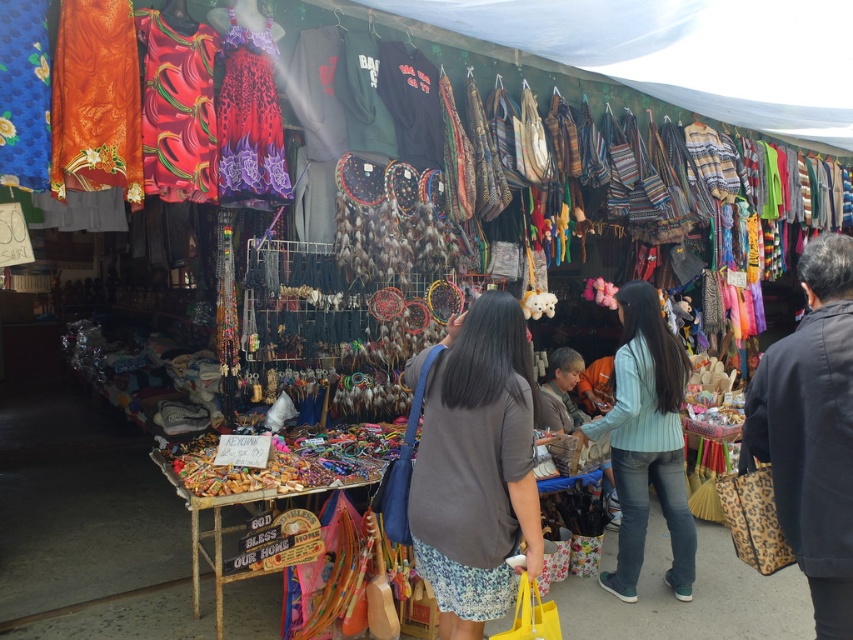
Can you confirm if dark gray shirt at center is positioned to the right of light blue striped shirt at center?

Incorrect, dark gray shirt at center is not on the right side of light blue striped shirt at center.

Where is `dark gray shirt at center`? dark gray shirt at center is located at coordinates (476, 467).

Who is more forward, (x=498, y=404) or (x=694, y=564)?

Point (x=498, y=404)

The height and width of the screenshot is (640, 853). Identify the location of dark gray shirt at center. (476, 467).